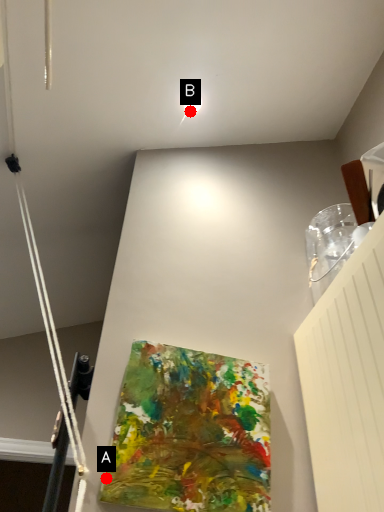
Question: Two points are circled on the image, labeled by A and B beside each circle. Which point appears closest to the camera in this image?

Choices:
 (A) A is closer
 (B) B is closer

Answer: (A)